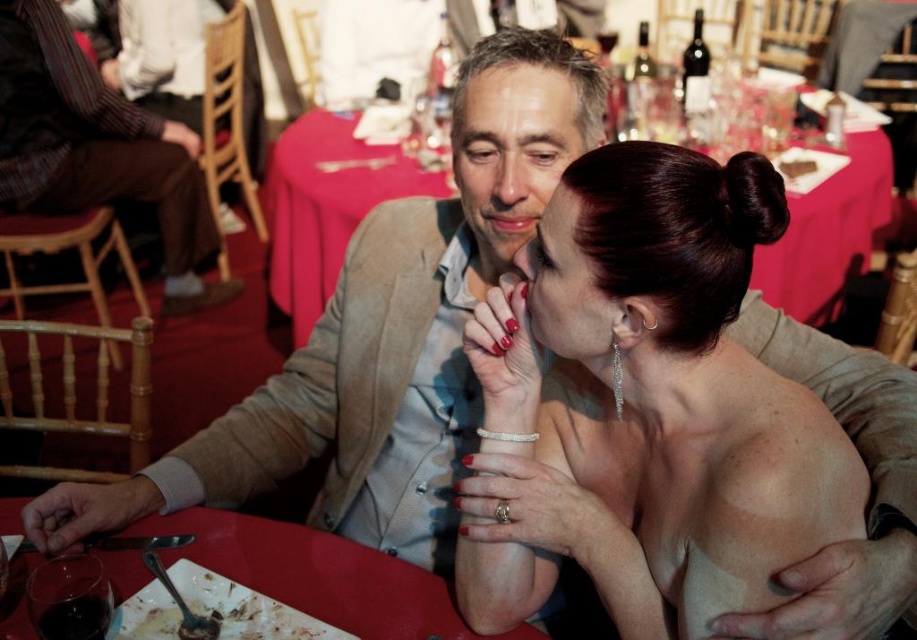
Between shiny silver earrings at center and smooth red tablecloth at center, which one has less height?

shiny silver earrings at center is shorter.

At what (x,y) coordinates should I click in order to perform the action: click on shiny silver earrings at center. Please return your answer as a coordinate pair (x, y). Image resolution: width=917 pixels, height=640 pixels. Looking at the image, I should click on pyautogui.click(x=645, y=406).

Measure the distance between shiny silver earrings at center and camera.

A distance of 30.69 inches exists between shiny silver earrings at center and camera.

Locate an element on the screen. The image size is (917, 640). shiny silver earrings at center is located at coordinates (645, 406).

Who is positioned more to the right, shiny silver earrings at center or smooth red table at center?

shiny silver earrings at center is more to the right.

Is shiny silver earrings at center behind smooth red table at center?

No, shiny silver earrings at center is closer to the viewer.

Is point (576, 467) less distant than point (395, 609)?

No, it is not.

The image size is (917, 640). Identify the location of shiny silver earrings at center. (645, 406).

Can you confirm if striped fabric pants at left is shorter than smooth red tablecloth at center?

Incorrect, striped fabric pants at left's height does not fall short of smooth red tablecloth at center's.

Is striped fabric pants at left to the right of smooth red tablecloth at center from the viewer's perspective?

No, striped fabric pants at left is not to the right of smooth red tablecloth at center.

The width and height of the screenshot is (917, 640). I want to click on striped fabric pants at left, so click(x=97, y=148).